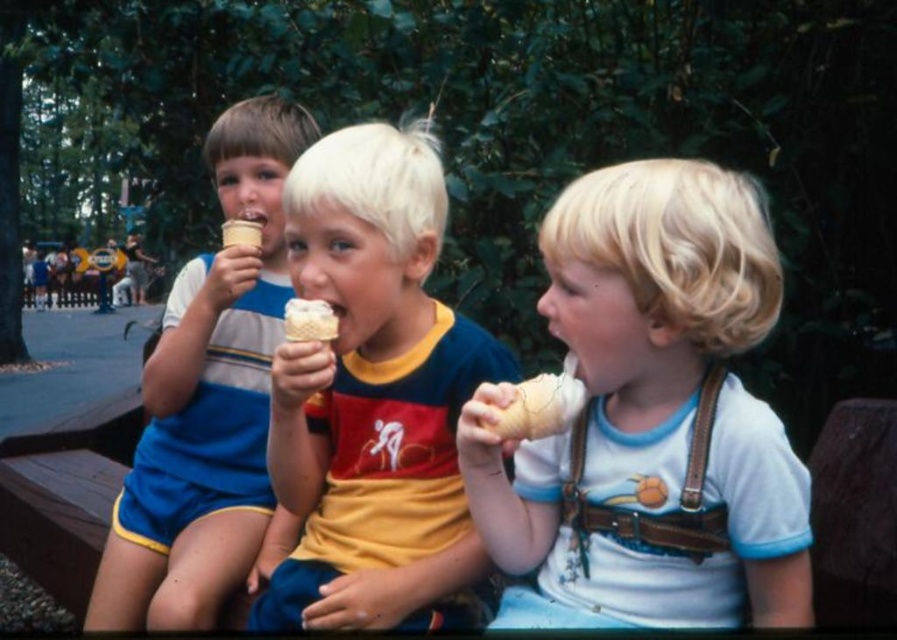
Is white matte ice cream cone at center positioned before matte blue shorts at left?

Yes, it is in front of matte blue shorts at left.

I want to click on white matte ice cream cone at center, so click(650, 419).

Can you confirm if white matte ice cream cone at center is positioned below yellow cotton shirt at center?

Indeed, white matte ice cream cone at center is positioned under yellow cotton shirt at center.

Does white matte ice cream cone at center have a greater width compared to yellow cotton shirt at center?

Correct, the width of white matte ice cream cone at center exceeds that of yellow cotton shirt at center.

Is point (733, 248) less distant than point (347, 372)?

Yes, it is.

At what (x,y) coordinates should I click in order to perform the action: click on white matte ice cream cone at center. Please return your answer as a coordinate pair (x, y). This screenshot has height=640, width=897. Looking at the image, I should click on (650, 419).

Can you confirm if yellow cotton shirt at center is taller than matte blue shorts at left?

Incorrect, yellow cotton shirt at center's height is not larger of matte blue shorts at left's.

Which is in front, point (386, 385) or point (285, 292)?

Positioned in front is point (386, 385).

The image size is (897, 640). Identify the location of yellow cotton shirt at center. (373, 388).